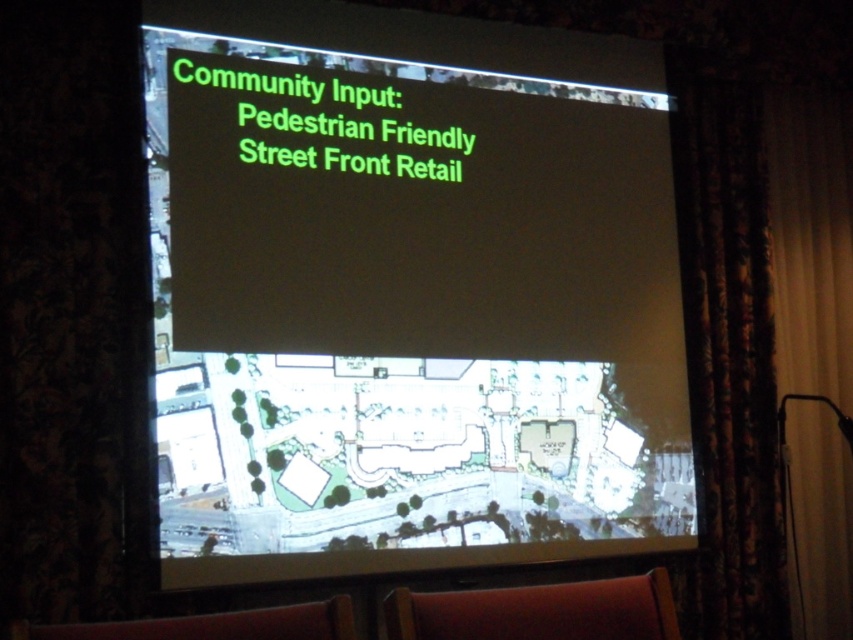
Question: Where is white paper at center located in relation to dark floral fabric curtain at right in the image?

Choices:
 (A) left
 (B) right

Answer: (A)

Question: Is dark floral fabric curtain at right thinner than brown leather armchair at lower center?

Choices:
 (A) no
 (B) yes

Answer: (B)

Question: Estimate the real-world distances between objects in this image. Which object is farther from the brown leather armchair at lower center?

Choices:
 (A) dark floral fabric curtain at right
 (B) red leather armchair at lower center
 (C) white paper at center

Answer: (A)

Question: Which point appears closest to the camera in this image?

Choices:
 (A) (218, 616)
 (B) (471, 595)
 (C) (740, 426)
 (D) (241, 484)

Answer: (A)

Question: Does dark floral fabric curtain at right have a lesser width compared to red leather armchair at lower center?

Choices:
 (A) yes
 (B) no

Answer: (A)

Question: Considering the real-world distances, which object is closest to the red leather armchair at lower center?

Choices:
 (A) brown leather armchair at lower center
 (B) dark floral fabric curtain at right

Answer: (A)